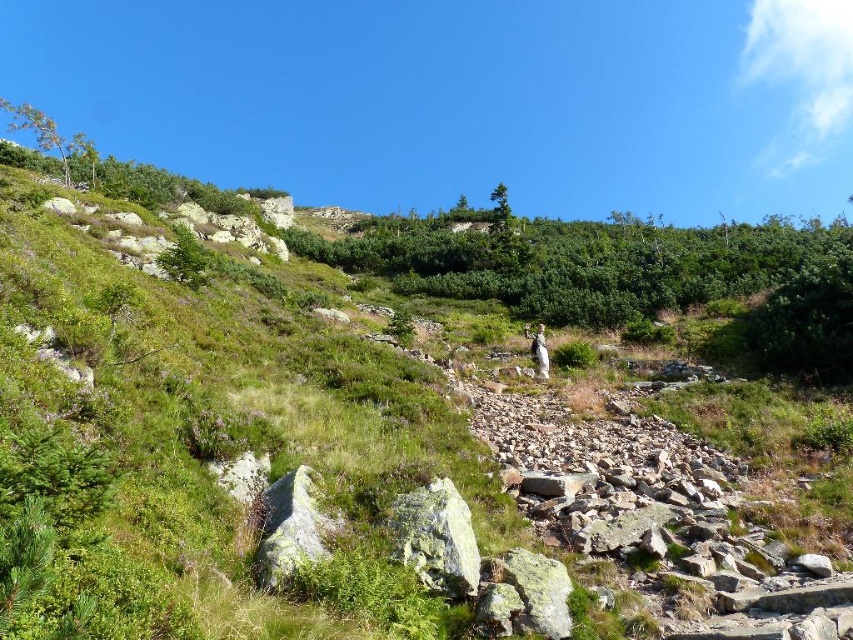
Question: Is white speckled rock at center thinner than white woolen sweater at center?

Choices:
 (A) no
 (B) yes

Answer: (A)

Question: Which point is farther from the camera taking this photo?

Choices:
 (A) (541, 333)
 (B) (306, 499)
 (C) (463, 577)

Answer: (A)

Question: Which object appears farthest from the camera in this image?

Choices:
 (A) white speckled rock at center
 (B) gray/rough rock at center

Answer: (A)

Question: Which point is closer to the camera taking this photo?

Choices:
 (A) (289, 480)
 (B) (538, 368)
 (C) (404, 547)

Answer: (C)

Question: Where is white speckled rock at center located in relation to gray/rough rock at center in the image?

Choices:
 (A) above
 (B) below

Answer: (B)

Question: Does gray/rough rock at center have a greater width compared to white woolen sweater at center?

Choices:
 (A) no
 (B) yes

Answer: (B)